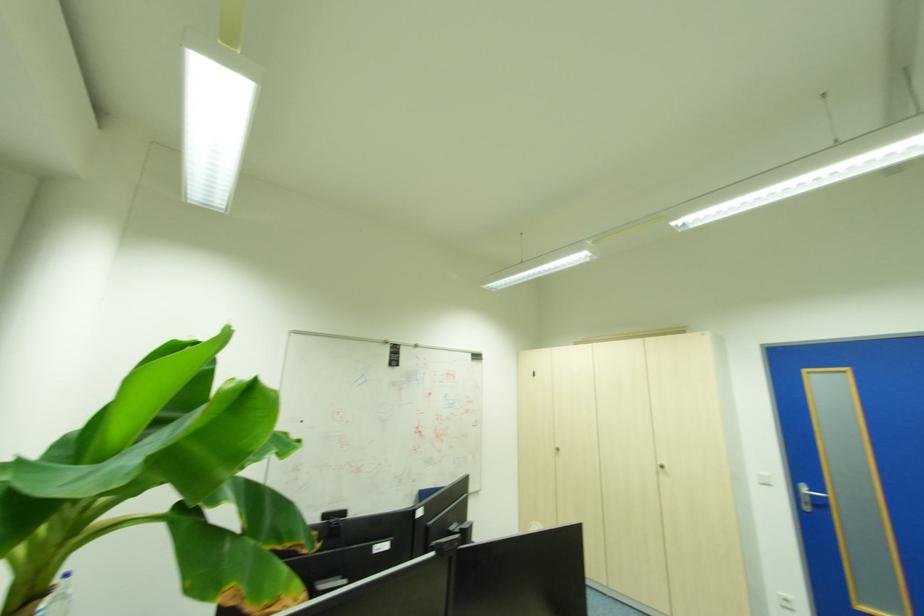
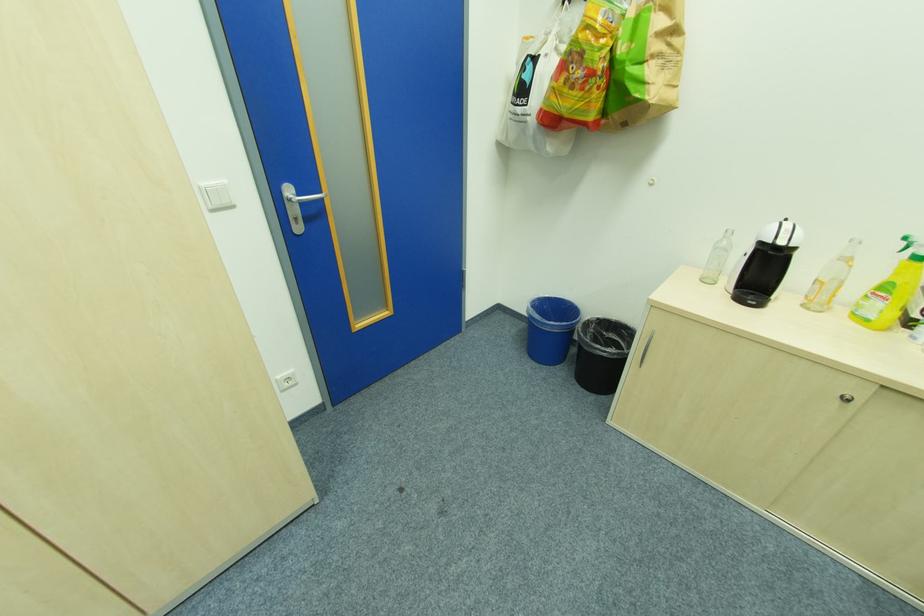
Find the pixel in the second image that matches point (815, 492) in the first image.

(304, 196)